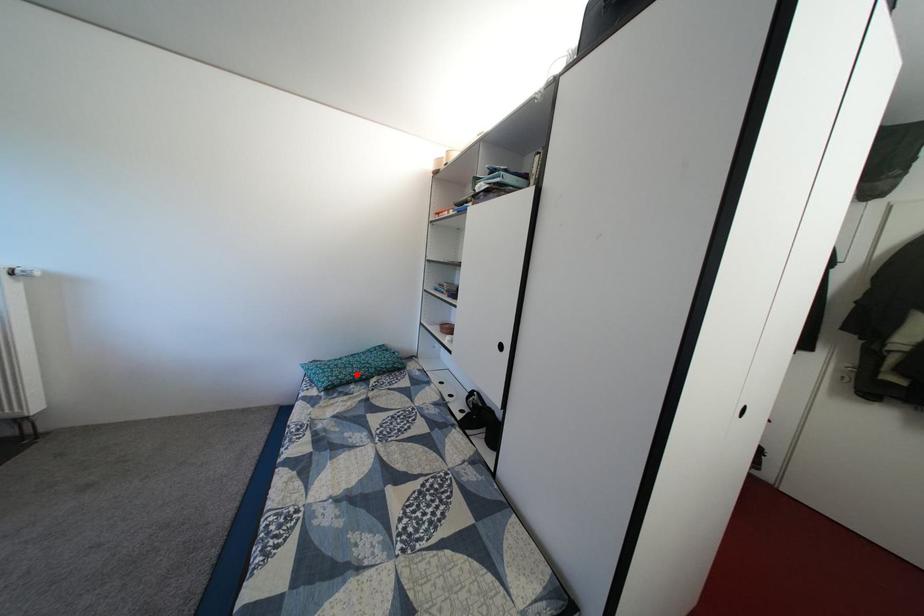
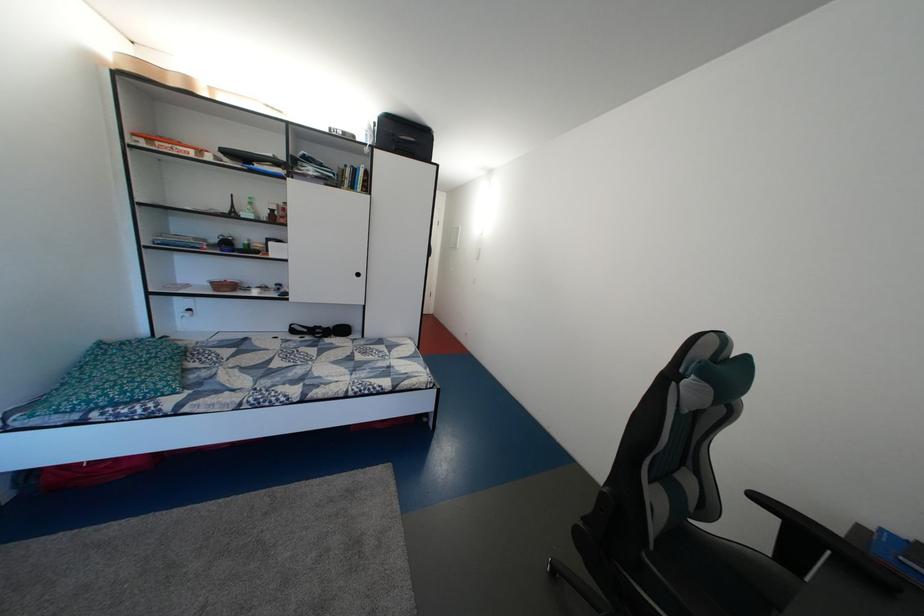
Find the pixel in the second image that matches the highlighted location in the first image.

(160, 376)